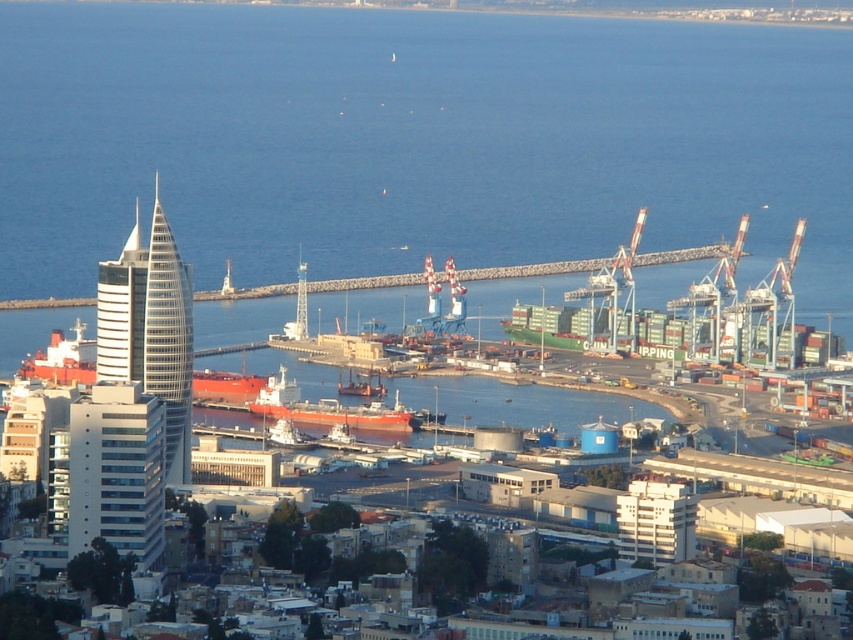
Question: Can you confirm if blue water at center is positioned to the right of matte orange ship at center?

Choices:
 (A) no
 (B) yes

Answer: (B)

Question: Does blue water at center come behind matte orange ship at center?

Choices:
 (A) no
 (B) yes

Answer: (A)

Question: Does blue water at center have a lesser width compared to matte orange ship at center?

Choices:
 (A) no
 (B) yes

Answer: (A)